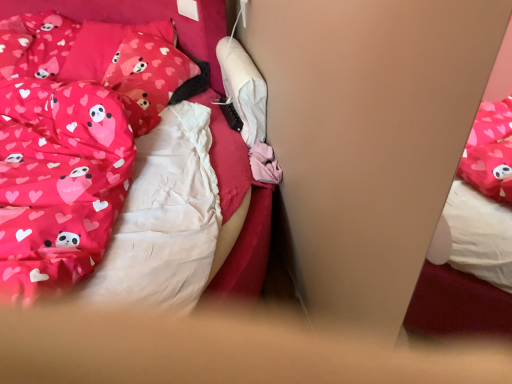
Question: Is pink satin bed at center far from matte pink fabric pillow at upper left, positioned as the 2th pillow in back-to-front order?

Choices:
 (A) yes
 (B) no

Answer: (B)

Question: Considering the relative sizes of pink satin bed at center and matte pink fabric pillow at upper left, positioned as the 2th pillow in back-to-front order, in the image provided, is pink satin bed at center wider than matte pink fabric pillow at upper left, positioned as the 2th pillow in back-to-front order,?

Choices:
 (A) no
 (B) yes

Answer: (B)

Question: Can you confirm if pink satin bed at center is thinner than matte pink fabric pillow at upper left, positioned as the 2th pillow in back-to-front order?

Choices:
 (A) no
 (B) yes

Answer: (A)

Question: Considering the relative sizes of pink satin bed at center and matte pink fabric pillow at upper left, arranged as the first pillow when viewed from the front, in the image provided, is pink satin bed at center shorter than matte pink fabric pillow at upper left, arranged as the first pillow when viewed from the front,?

Choices:
 (A) yes
 (B) no

Answer: (B)

Question: Considering the relative positions of pink satin bed at center and matte pink fabric pillow at upper left, positioned as the 2th pillow in back-to-front order, in the image provided, is pink satin bed at center behind matte pink fabric pillow at upper left, positioned as the 2th pillow in back-to-front order,?

Choices:
 (A) yes
 (B) no

Answer: (B)

Question: Would you say matte pink fabric pillow at upper left, positioned as the 2th pillow in back-to-front order, is to the left or to the right of pink satin bed at center in the picture?

Choices:
 (A) right
 (B) left

Answer: (A)

Question: From their relative heights in the image, would you say matte pink fabric pillow at upper left, positioned as the 2th pillow in back-to-front order, is taller or shorter than pink satin bed at center?

Choices:
 (A) short
 (B) tall

Answer: (A)

Question: From the image's perspective, is matte pink fabric pillow at upper left, arranged as the first pillow when viewed from the front, positioned above or below pink satin bed at center?

Choices:
 (A) below
 (B) above

Answer: (B)

Question: Do you think matte pink fabric pillow at upper left, positioned as the 2th pillow in back-to-front order, is within pink satin bed at center, or outside of it?

Choices:
 (A) outside
 (B) inside

Answer: (A)

Question: Would you say matte pink fabric pillow at upper left, positioned as the 2th pillow in back-to-front order, is to the left or to the right of pink fabric pillow at upper left, the 2th pillow in the front-to-back sequence, in the picture?

Choices:
 (A) right
 (B) left

Answer: (A)

Question: In terms of height, does matte pink fabric pillow at upper left, positioned as the 2th pillow in back-to-front order, look taller or shorter compared to pink fabric pillow at upper left, the 2th pillow in the front-to-back sequence?

Choices:
 (A) short
 (B) tall

Answer: (A)

Question: Does point (137, 89) appear closer or farther from the camera than point (135, 72)?

Choices:
 (A) farther
 (B) closer

Answer: (B)

Question: Considering their positions, is matte pink fabric pillow at upper left, positioned as the 2th pillow in back-to-front order, located in front of or behind pink fabric pillow at upper left, the 2th pillow in the front-to-back sequence?

Choices:
 (A) behind
 (B) front

Answer: (B)

Question: From a real-world perspective, is pink fabric pillow at upper left, the 2th pillow in the front-to-back sequence, physically located above or below pink satin bed at center?

Choices:
 (A) below
 (B) above

Answer: (B)

Question: In the image, is pink fabric pillow at upper left, the 2th pillow in the front-to-back sequence, positioned in front of or behind pink satin bed at center?

Choices:
 (A) front
 (B) behind

Answer: (B)